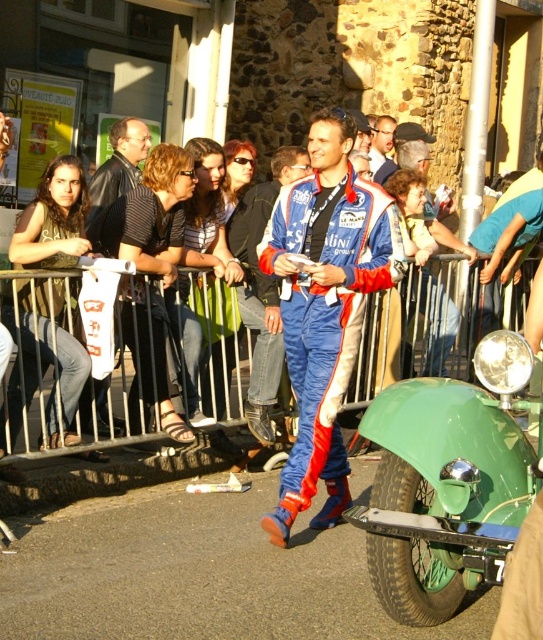
You are a photographer at the event and want to capture both the blue racing suit at center and the blue fabric racing suit at center in a single shot. Which one should you focus on first to ensure both are in frame?

The blue racing suit at center is positioned under the blue fabric racing suit at center, so focusing on the blue fabric racing suit at center first would allow the blue racing suit at center to be captured below it in the frame.